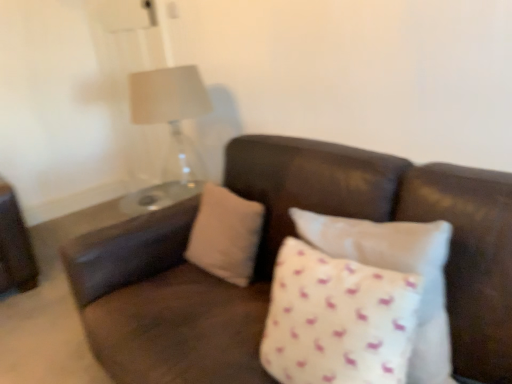
Question: Considering the relative positions of white dotted pillow at center, which ranks as the first pillow in front-to-back order, and beige fabric pillow at center, acting as the 2th pillow starting from the front, in the image provided, is white dotted pillow at center, which ranks as the first pillow in front-to-back order, in front of beige fabric pillow at center, acting as the 2th pillow starting from the front,?

Choices:
 (A) no
 (B) yes

Answer: (B)

Question: Considering the relative positions of white dotted pillow at center, the second pillow from the back, and beige fabric pillow at center, acting as the 2th pillow starting from the front, in the image provided, is white dotted pillow at center, the second pillow from the back, to the right of beige fabric pillow at center, acting as the 2th pillow starting from the front, from the viewer's perspective?

Choices:
 (A) yes
 (B) no

Answer: (A)

Question: Considering the relative sizes of white dotted pillow at center, which ranks as the first pillow in front-to-back order, and beige fabric pillow at center, acting as the 2th pillow starting from the front, in the image provided, is white dotted pillow at center, which ranks as the first pillow in front-to-back order, thinner than beige fabric pillow at center, acting as the 2th pillow starting from the front,?

Choices:
 (A) yes
 (B) no

Answer: (B)

Question: Does white dotted pillow at center, which ranks as the first pillow in front-to-back order, have a greater width compared to beige fabric pillow at center, which is the first pillow in back-to-front order?

Choices:
 (A) no
 (B) yes

Answer: (B)

Question: Is white dotted pillow at center, which ranks as the first pillow in front-to-back order, smaller than beige fabric pillow at center, acting as the 2th pillow starting from the front?

Choices:
 (A) no
 (B) yes

Answer: (A)

Question: From a real-world perspective, is white dotted pillow at center, which ranks as the first pillow in front-to-back order, over beige fabric pillow at center, which is the first pillow in back-to-front order?

Choices:
 (A) no
 (B) yes

Answer: (B)

Question: Is beige fabric pillow at center, acting as the 2th pillow starting from the front, not within white dotted pillow at center, the second pillow from the back?

Choices:
 (A) yes
 (B) no

Answer: (A)

Question: Considering the relative sizes of beige fabric pillow at center, which is the first pillow in back-to-front order, and white dotted pillow at center, which ranks as the first pillow in front-to-back order, in the image provided, is beige fabric pillow at center, which is the first pillow in back-to-front order, thinner than white dotted pillow at center, which ranks as the first pillow in front-to-back order,?

Choices:
 (A) yes
 (B) no

Answer: (A)

Question: From the image's perspective, is beige fabric pillow at center, acting as the 2th pillow starting from the front, beneath white dotted pillow at center, the second pillow from the back?

Choices:
 (A) yes
 (B) no

Answer: (B)

Question: Does beige fabric pillow at center, which is the first pillow in back-to-front order, have a smaller size compared to white dotted pillow at center, the second pillow from the back?

Choices:
 (A) no
 (B) yes

Answer: (B)

Question: From a real-world perspective, is beige fabric pillow at center, which is the first pillow in back-to-front order, positioned under white dotted pillow at center, which ranks as the first pillow in front-to-back order, based on gravity?

Choices:
 (A) no
 (B) yes

Answer: (B)

Question: From the image's perspective, is beige fabric pillow at center, acting as the 2th pillow starting from the front, on white dotted pillow at center, the second pillow from the back?

Choices:
 (A) yes
 (B) no

Answer: (A)

Question: Would you say white dotted pillow at center, the second pillow from the back, is to the left or to the right of beige fabric pillow at center, acting as the 2th pillow starting from the front, in the picture?

Choices:
 (A) left
 (B) right

Answer: (B)